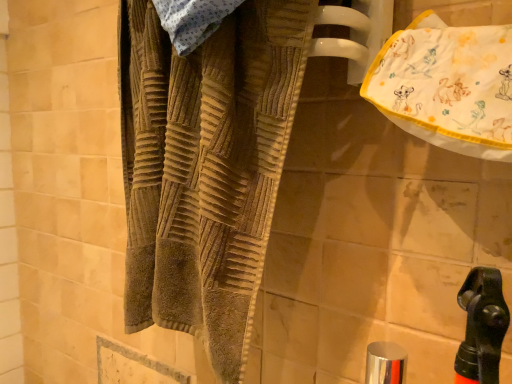
Question: In terms of size, does white cotton towel at upper right appear bigger or smaller than silver metallic faucet at lower center?

Choices:
 (A) big
 (B) small

Answer: (A)

Question: Is white cotton towel at upper right taller or shorter than silver metallic faucet at lower center?

Choices:
 (A) tall
 (B) short

Answer: (A)

Question: Which is farther from the brown textured towel at center?

Choices:
 (A) silver metallic faucet at lower center
 (B) white cotton towel at upper right

Answer: (A)

Question: Which is nearer to the silver metallic faucet at lower center?

Choices:
 (A) white cotton towel at upper right
 (B) brown textured towel at center

Answer: (A)